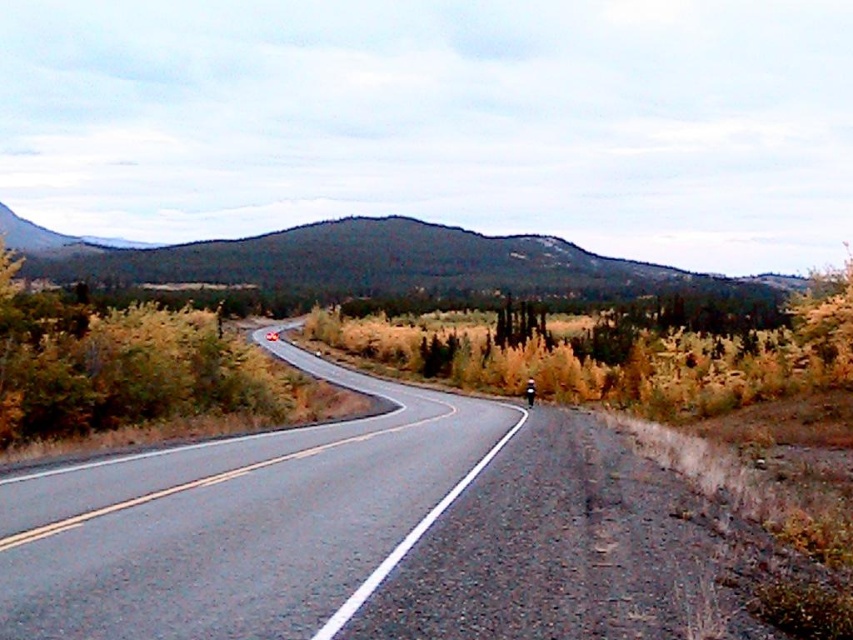
You are standing at the point closer to you on the road and want to walk towards the distant hills. Which point should you head towards, point (135,282) or point (125,326)?

You should head towards point (125,326) because it is closer to the distant hills compared to point (135,282), which is nearer to your current position.

You are a hiker planning to take a photo of the green forested mountain at upper center and the green leafy shrub at left. Which object should you focus on first if you want to capture both in a single frame without moving the camera?

The green forested mountain at upper center is taller than the green leafy shrub at left, so you should focus on the green forested mountain at upper center first to ensure it is in focus, then adjust for the closer shrub.

You are a hiker standing at the starting point of the road. You want to reach the green forested mountain at upper center. According to the map, the mountain is located at point (373,262). What direction should you head towards from the road to reach the mountain?

The green forested mountain at upper center is located at point (373,262), so you should head towards the upper center direction from the road to reach it.